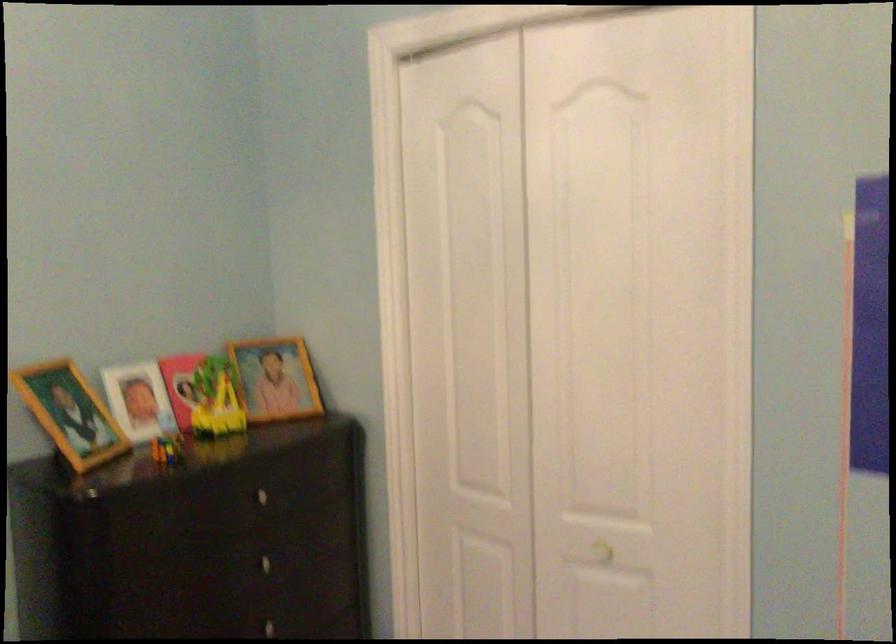
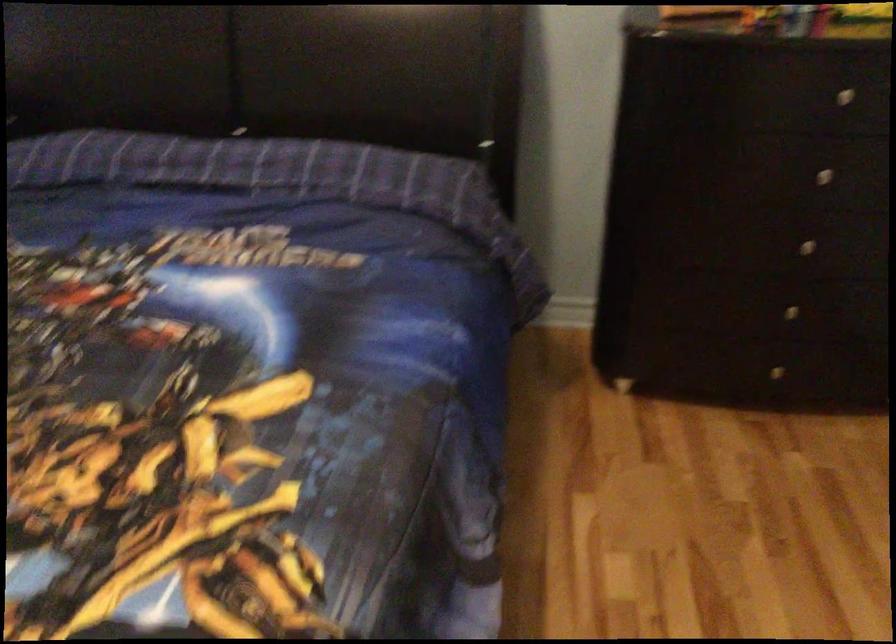
In the second image, find the point that corresponds to [268,489] in the first image.

(858, 91)